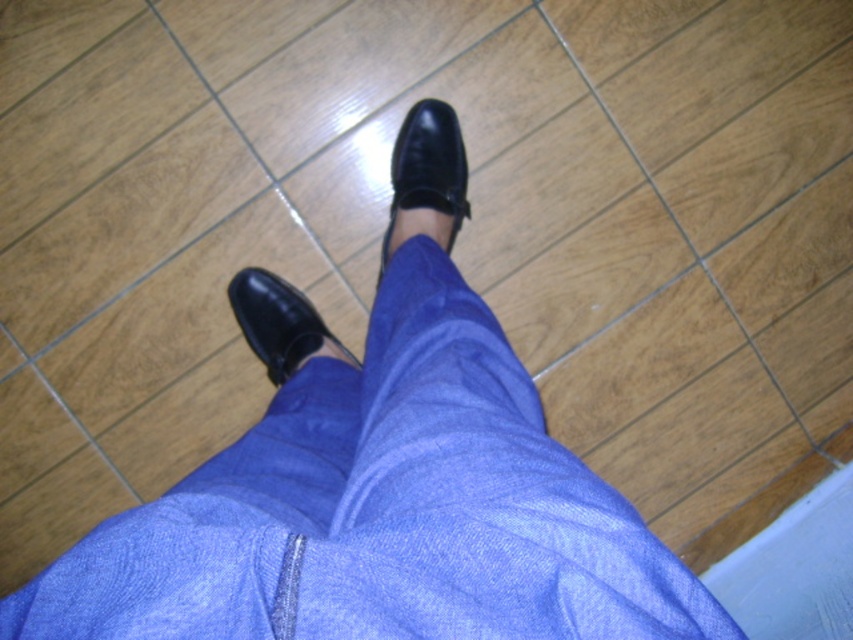
Question: Can you confirm if shiny black shoe at center is smaller than black leather shoe at lower center?

Choices:
 (A) yes
 (B) no

Answer: (A)

Question: In this image, where is denim pants at center located relative to black leather shoe at lower center?

Choices:
 (A) right
 (B) left

Answer: (A)

Question: Which of the following is the farthest from the observer?

Choices:
 (A) (141, 576)
 (B) (286, 292)
 (C) (407, 172)

Answer: (C)

Question: Which of these objects is positioned closest to the shiny black shoe at center?

Choices:
 (A) denim pants at center
 (B) black leather shoe at lower center

Answer: (B)

Question: Which point is closer to the camera?

Choices:
 (A) black leather shoe at lower center
 (B) denim pants at center
 (C) shiny black shoe at center

Answer: (B)

Question: Can you confirm if denim pants at center is smaller than black leather shoe at lower center?

Choices:
 (A) no
 (B) yes

Answer: (A)